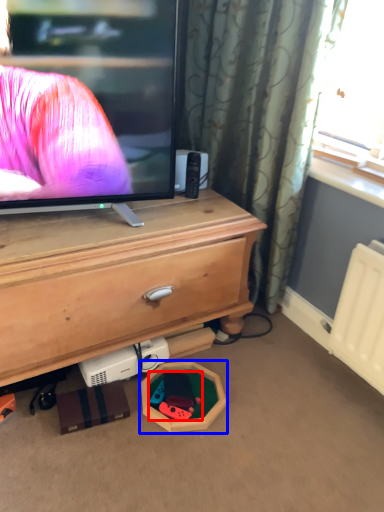
Question: Which object appears closest to the camera in this image, toy (highlighted by a red box) or toy (highlighted by a blue box)?

Choices:
 (A) toy
 (B) toy

Answer: (B)